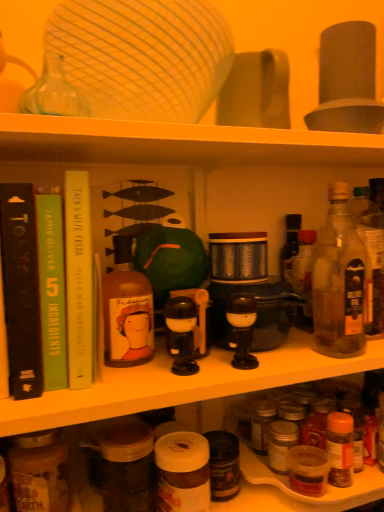
Where is `black matte book at left, which is counted as the third book, starting from the right`? Image resolution: width=384 pixels, height=512 pixels. black matte book at left, which is counted as the third book, starting from the right is located at coordinates (21, 289).

Image resolution: width=384 pixels, height=512 pixels. Describe the element at coordinates (21, 289) in the screenshot. I see `black matte book at left, the 1th book positioned from the left` at that location.

How much space does green paperback book at left, positioned as the 2th book in right-to-left order, occupy vertically?

It is 10.28 inches.

Describe the element at coordinates (374, 255) in the screenshot. I see `translucent glass bottle at right, placed as the 4th bottle when sorted from left to right` at that location.

Where is `black matte book at left, which is counted as the third book, starting from the right`? Image resolution: width=384 pixels, height=512 pixels. black matte book at left, which is counted as the third book, starting from the right is located at coordinates (21, 289).

Identify the location of toy that is on the left side of matte black coffee machine at center. This screenshot has width=384, height=512. (186, 329).

How different are the orientations of black plastic toy at center and matte black coffee machine at center in degrees?

0.419 degrees separate the facing orientations of black plastic toy at center and matte black coffee machine at center.

Who is bigger, black plastic toy at center or matte black coffee machine at center?

With larger size is matte black coffee machine at center.

Would you consider black plastic toy at center to be distant from matte black coffee machine at center?

No.

Based on the photo, can you confirm if black plastic toy at center is bigger than clear glass bottle at right, which appears as the third bottle when viewed from the left?

A: No.

Which of these two, black plastic toy at center or clear glass bottle at right, which appears as the third bottle when viewed from the left, is thinner?

With smaller width is clear glass bottle at right, which appears as the third bottle when viewed from the left.

Is black plastic toy at center positioned with its back to clear glass bottle at right, which appears as the third bottle when viewed from the left?

No, black plastic toy at center's orientation is not away from clear glass bottle at right, which appears as the third bottle when viewed from the left.

Would you say clear glass bottle at right, which appears as the third bottle when viewed from the left, is part of black plastic toy at center's contents?

No, black plastic toy at center does not contain clear glass bottle at right, which appears as the third bottle when viewed from the left.

Could you tell me if matte black coffee machine at center is facing translucent plastic spice jar at lower center?

No.

Considering the relative sizes of matte black coffee machine at center and translucent plastic spice jar at lower center in the image provided, is matte black coffee machine at center shorter than translucent plastic spice jar at lower center?

No.

From a real-world perspective, between matte black coffee machine at center and translucent plastic spice jar at lower center, who is vertically lower?

In real-world perspective, translucent plastic spice jar at lower center is lower.

Considering the positions of objects matte black coffee machine at center and translucent plastic spice jar at lower center in the image provided, who is more to the left, matte black coffee machine at center or translucent plastic spice jar at lower center?

matte black coffee machine at center is more to the left.

Where is `the 1st book positioned below the yellow paperback book at upper left, which is the first book in right-to-left order (from a real-world perspective)`? The image size is (384, 512). the 1st book positioned below the yellow paperback book at upper left, which is the first book in right-to-left order (from a real-world perspective) is located at coordinates (21, 289).

Is black matte book at left, the 1th book positioned from the left, spatially inside yellow paperback book at upper left, the third book viewed from the left, or outside of it?

black matte book at left, the 1th book positioned from the left, is outside yellow paperback book at upper left, the third book viewed from the left.

Is black matte book at left, which is counted as the third book, starting from the right, at the right side of yellow paperback book at upper left, which is the first book in right-to-left order?

In fact, black matte book at left, which is counted as the third book, starting from the right, is to the left of yellow paperback book at upper left, which is the first book in right-to-left order.

Is black matte book at left, which is counted as the third book, starting from the right, positioned with its back to yellow paperback book at upper left, the third book viewed from the left?

No, yellow paperback book at upper left, the third book viewed from the left, is not at the back of black matte book at left, which is counted as the third book, starting from the right.

Who is more distant, matte glass bottle at center-left, which is the 2th bottle from left to right, or brown glass jar at lower left, positioned as the fourth bottle in right-to-left order?

Positioned behind is matte glass bottle at center-left, which is the 2th bottle from left to right.

Considering the sizes of objects matte glass bottle at center-left, which is the third bottle in right-to-left order, and brown glass jar at lower left, positioned as the fourth bottle in right-to-left order, in the image provided, who is thinner, matte glass bottle at center-left, which is the third bottle in right-to-left order, or brown glass jar at lower left, positioned as the fourth bottle in right-to-left order,?

With smaller width is matte glass bottle at center-left, which is the third bottle in right-to-left order.

From the brown glass jar at lower left, positioned as the fourth bottle in right-to-left order, count 1st bottle to the right and point to it. Please provide its 2D coordinates.

[(127, 310)]

From a real-world perspective, is matte glass bottle at center-left, which is the third bottle in right-to-left order, physically below brown glass jar at lower left, acting as the 1th bottle starting from the left?

No, from a real-world perspective, matte glass bottle at center-left, which is the third bottle in right-to-left order, is not beneath brown glass jar at lower left, acting as the 1th bottle starting from the left.

Is black matte book at left, the 1th book positioned from the left, to the right of black plastic toy at center from the viewer's perspective?

In fact, black matte book at left, the 1th book positioned from the left, is to the left of black plastic toy at center.

Who is shorter, black matte book at left, which is counted as the third book, starting from the right, or black plastic toy at center?

With less height is black plastic toy at center.

Can you confirm if black matte book at left, the 1th book positioned from the left, is wider than black plastic toy at center?

Yes, black matte book at left, the 1th book positioned from the left, is wider than black plastic toy at center.

Is point (9, 190) positioned before point (191, 368)?

Yes, it is in front of point (191, 368).

Can you tell me how much matte black coffee machine at center and yellow paperback book at upper left, which is the first book in right-to-left order, differ in facing direction?

1.21 degrees separate the facing orientations of matte black coffee machine at center and yellow paperback book at upper left, which is the first book in right-to-left order.

Based on the photo, do you think matte black coffee machine at center is within yellow paperback book at upper left, the third book viewed from the left, or outside of it?

matte black coffee machine at center is not inside yellow paperback book at upper left, the third book viewed from the left, it's outside.

Is matte black coffee machine at center further to the viewer compared to yellow paperback book at upper left, which is the first book in right-to-left order?

Yes, matte black coffee machine at center is further from the viewer.

Who is taller, matte black coffee machine at center or yellow paperback book at upper left, the third book viewed from the left?

Standing taller between the two is yellow paperback book at upper left, the third book viewed from the left.

Locate an element on the screen. coffee machine behind the black plastic toy at center is located at coordinates (247, 290).

I want to click on toy on the left of clear glass bottle at right, which appears as the third bottle when viewed from the left, so click(x=186, y=329).

Which object lies further to the anchor point green paperback book at left, the second book viewed from the left, yellow paperback book at upper left, which is the first book in right-to-left order, or black plastic toy at center?

Among the two, black plastic toy at center is located further to green paperback book at left, the second book viewed from the left.

In the scene shown: Which object lies further to the anchor point brown glass jar at lower left, acting as the 1th bottle starting from the left, yellow paperback book at upper left, which is the first book in right-to-left order, or black plastic toy at center?

black plastic toy at center.

When comparing their distances from matte black coffee machine at center, does translucent plastic spice jar at lower center or black plastic toy at center seem closer?

black plastic toy at center.

Which object lies nearer to the anchor point matte black coffee machine at center, translucent plastic spice jar at lower center or green paperback book at left, positioned as the 2th book in right-to-left order?

translucent plastic spice jar at lower center is closer to matte black coffee machine at center.

From the image, which object appears to be nearer to brown glass jar at lower left, positioned as the fourth bottle in right-to-left order, matte black coffee machine at center or clear glass bottle at right, marked as the second bottle in a right-to-left arrangement?

Among the two, matte black coffee machine at center is located nearer to brown glass jar at lower left, positioned as the fourth bottle in right-to-left order.

Considering their positions, is translucent glass bottle at right, placed as the 4th bottle when sorted from left to right, positioned further to clear glass bottle at right, which appears as the third bottle when viewed from the left, than matte glass bottle at center-left, which is the third bottle in right-to-left order?

matte glass bottle at center-left, which is the third bottle in right-to-left order, is further to clear glass bottle at right, which appears as the third bottle when viewed from the left.

Considering their positions, is translucent plastic spice jar at lower center positioned further to green paperback book at left, the second book viewed from the left, than black plastic toy at center?

translucent plastic spice jar at lower center lies further to green paperback book at left, the second book viewed from the left, than the other object.

Which object lies further to the anchor point brown glass jar at lower left, acting as the 1th bottle starting from the left, black plastic toy at center or translucent plastic spice jar at lower center?

The object further to brown glass jar at lower left, acting as the 1th bottle starting from the left, is translucent plastic spice jar at lower center.

Identify the location of toy between yellow paperback book at upper left, which is the first book in right-to-left order, and translucent plastic spice jar at lower center from left to right. (186, 329).

Where is `bottle located between matte glass bottle at center-left, which is the third bottle in right-to-left order, and translucent plastic spice jar at lower center in the left-right direction`? Image resolution: width=384 pixels, height=512 pixels. bottle located between matte glass bottle at center-left, which is the third bottle in right-to-left order, and translucent plastic spice jar at lower center in the left-right direction is located at coordinates (338, 281).

Locate an element on the screen. The width and height of the screenshot is (384, 512). drink between black plastic toy at center and translucent glass bottle at right, the first bottle viewed from the right, from left to right is located at coordinates (307, 496).

You are a GUI agent. You are given a task and a screenshot of the screen. Output one action in this format:
    pyautogui.click(x=<x>, y=<y>)
    Task: Click on the coffee machine that lies between clear glass bottle at right, which appears as the third bottle when viewed from the left, and translucent plastic spice jar at lower center from top to bottom
    The height and width of the screenshot is (512, 384).
    Given the screenshot: What is the action you would take?
    pyautogui.click(x=247, y=290)